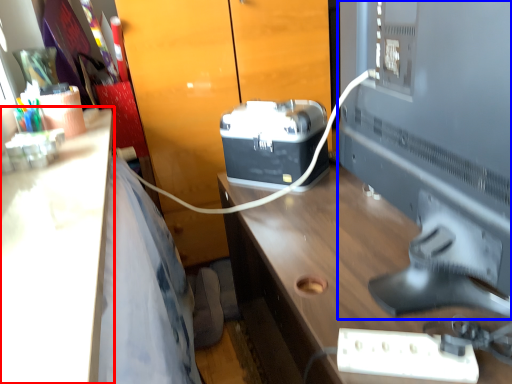
Question: Which object appears closest to the camera in this image, desk (highlighted by a red box) or desktop computer (highlighted by a blue box)?

Choices:
 (A) desk
 (B) desktop computer

Answer: (A)